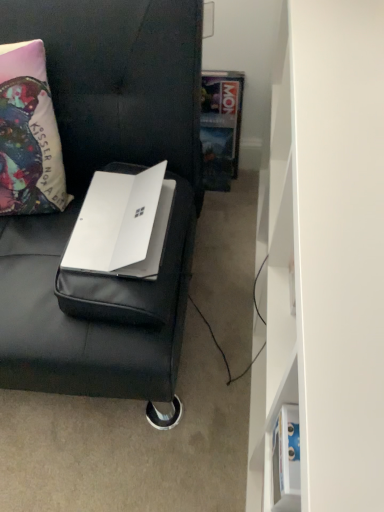
Measure the distance between point [101,230] and camera.

The distance of point [101,230] from camera is 36.38 inches.

The height and width of the screenshot is (512, 384). Describe the element at coordinates (29, 134) in the screenshot. I see `matte fabric pillow at left` at that location.

Find the location of a particular element. Image resolution: width=384 pixels, height=512 pixels. white matte bookshelf at right is located at coordinates (323, 256).

This screenshot has height=512, width=384. What are the coordinates of `white matte laptop at center` in the screenshot? It's located at (122, 224).

Is matte fabric pillow at left looking in the opposite direction of white matte bookshelf at right?

No.

Where is `pillow above the white matte bookshelf at right (from a real-world perspective)`? pillow above the white matte bookshelf at right (from a real-world perspective) is located at coordinates (29, 134).

Do you think matte fabric pillow at left is within white matte bookshelf at right, or outside of it?

matte fabric pillow at left is not enclosed by white matte bookshelf at right.

Considering the points (1, 79) and (357, 319), which point is in front, point (1, 79) or point (357, 319)?

The point (357, 319) is more forward.

Is white matte bookshelf at right turned away from matte fabric pillow at left?

No, white matte bookshelf at right's orientation is not away from matte fabric pillow at left.

Is white matte bookshelf at right situated inside matte fabric pillow at left or outside?

white matte bookshelf at right is spatially situated outside matte fabric pillow at left.

Is there a large distance between white matte bookshelf at right and matte fabric pillow at left?

Actually, white matte bookshelf at right and matte fabric pillow at left are a little close together.

Is point (233, 97) positioned after point (292, 26)?

Yes, point (233, 97) is farther from viewer.

Is hardcover book at center wider than white matte bookshelf at right?

In fact, hardcover book at center might be narrower than white matte bookshelf at right.

Is hardcover book at center to the right of white matte bookshelf at right from the viewer's perspective?

No.

Could white matte bookshelf at right be considered to be inside hardcover book at center?

Definitely not — white matte bookshelf at right is not inside hardcover book at center.

Which is in front, point (230, 82) or point (6, 73)?

Positioned in front is point (6, 73).

Is the position of hardcover book at center less distant than that of matte fabric pillow at left?

No.

Can you tell me how much hardcover book at center and matte fabric pillow at left differ in facing direction?

They differ by 5.95 degrees in their facing directions.

Would you say matte fabric pillow at left is part of hardcover book at center's contents?

No, matte fabric pillow at left is not a part of hardcover book at center.

Between white matte laptop at left and matte fabric pillow at left, which one has more height?

white matte laptop at left is taller.

From a real-world perspective, who is located lower, white matte laptop at left or matte fabric pillow at left?

In real-world perspective, white matte laptop at left is lower.

Who is bigger, white matte laptop at left or matte fabric pillow at left?

white matte laptop at left.

From the picture: Is white matte laptop at left closer to camera compared to matte fabric pillow at left?

Yes, white matte laptop at left is closer to the camera.

Based on the photo, who is smaller, white matte laptop at center or hardcover book at center?

With smaller size is white matte laptop at center.

Is white matte laptop at center wider or thinner than hardcover book at center?

Considering their sizes, white matte laptop at center looks broader than hardcover book at center.

Does white matte laptop at center come behind hardcover book at center?

No, white matte laptop at center is closer to the viewer.

In the scene shown: Between white matte laptop at center and matte fabric pillow at left, which one appears on the right side from the viewer's perspective?

From the viewer's perspective, white matte laptop at center appears more on the right side.

Is white matte laptop at center in front of or behind matte fabric pillow at left in the image?

In the image, white matte laptop at center appears behind matte fabric pillow at left.

Is point (155, 215) positioned behind point (59, 180)?

No, it is not.

Based on the photo, would you say white matte laptop at center contains matte fabric pillow at left?

No, matte fabric pillow at left is located outside of white matte laptop at center.

In order to click on bookshelf in front of the matte fabric pillow at left in this screenshot , I will do `click(323, 256)`.

Find the location of `pillow on the left of white matte bookshelf at right`. pillow on the left of white matte bookshelf at right is located at coordinates (29, 134).

When comparing their distances from white matte bookshelf at right, does white matte laptop at center or hardcover book at center seem further?

Based on the image, hardcover book at center appears to be further to white matte bookshelf at right.

Looking at this image, which object lies nearer to the anchor point white matte laptop at center, white matte bookshelf at right or white matte laptop at left?

The object closer to white matte laptop at center is white matte laptop at left.

From the image, which object appears to be nearer to white matte laptop at center, hardcover book at center or white matte bookshelf at right?

white matte bookshelf at right is positioned closer to the anchor white matte laptop at center.

When comparing their distances from matte fabric pillow at left, does hardcover book at center or white matte laptop at center seem closer?

Among the two, white matte laptop at center is located nearer to matte fabric pillow at left.

Which object lies further to the anchor point white matte bookshelf at right, matte fabric pillow at left or white matte laptop at left?

matte fabric pillow at left is further to white matte bookshelf at right.

Looking at the image, which one is located further to hardcover book at center, matte fabric pillow at left or white matte laptop at left?

The object further to hardcover book at center is matte fabric pillow at left.

When comparing their distances from white matte bookshelf at right, does white matte laptop at center or white matte laptop at left seem closer?

Based on the image, white matte laptop at left appears to be nearer to white matte bookshelf at right.

From the image, which object appears to be farther from matte fabric pillow at left, white matte laptop at center or white matte laptop at left?

white matte laptop at center.

Image resolution: width=384 pixels, height=512 pixels. I want to click on furniture between white matte bookshelf at right and hardcover book at center from front to back, so click(x=85, y=193).

Where is `pillow between white matte laptop at left and white matte laptop at center along the z-axis`? Image resolution: width=384 pixels, height=512 pixels. pillow between white matte laptop at left and white matte laptop at center along the z-axis is located at coordinates (29, 134).

Where is `pillow located between white matte laptop at left and hardcover book at center in the depth direction`? The image size is (384, 512). pillow located between white matte laptop at left and hardcover book at center in the depth direction is located at coordinates (29, 134).

I want to click on laptop between white matte laptop at left and hardcover book at center from front to back, so click(x=122, y=224).